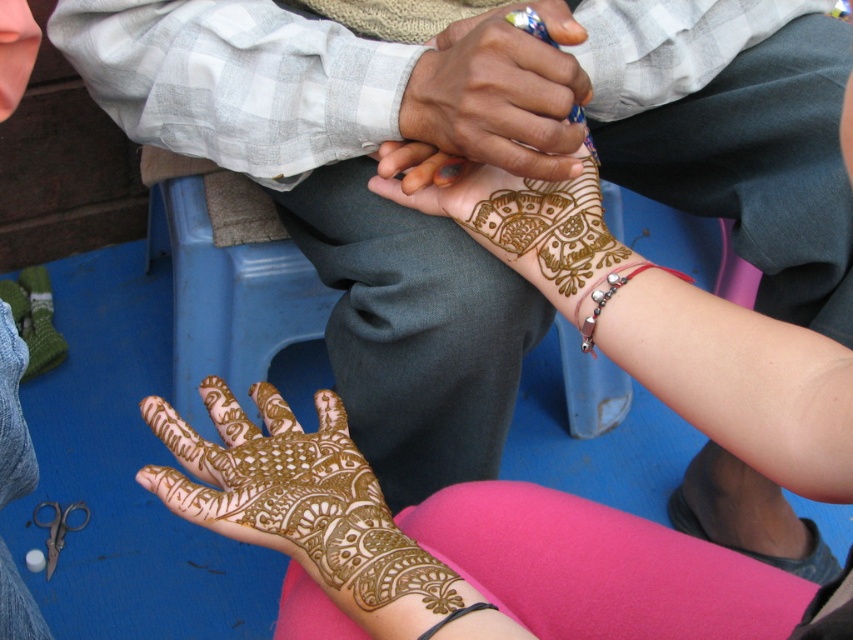
In the scene shown: Who is taller, brown henna tattoo at center or silver metallic bracelet at lower center?

Standing taller between the two is brown henna tattoo at center.

Can you confirm if brown henna tattoo at center is positioned to the left of silver metallic bracelet at lower center?

Yes, brown henna tattoo at center is to the left of silver metallic bracelet at lower center.

Where is `brown henna tattoo at center`? This screenshot has width=853, height=640. brown henna tattoo at center is located at coordinates (300, 502).

You are a GUI agent. You are given a task and a screenshot of the screen. Output one action in this format:
    pyautogui.click(x=<x>, y=<y>)
    Task: Click on the brown henna tattoo at center
    
    Given the screenshot: What is the action you would take?
    pyautogui.click(x=300, y=502)

The image size is (853, 640). What do you see at coordinates (491, 100) in the screenshot? I see `brown henna at center` at bounding box center [491, 100].

Is point (419, 74) less distant than point (611, 289)?

No, (419, 74) is further to viewer.

Locate an element on the screen. brown henna at center is located at coordinates (491, 100).

Is brown henna tattoo at center taller than brown henna at center?

Incorrect, brown henna tattoo at center's height is not larger of brown henna at center's.

Does brown henna tattoo at center lie in front of brown henna at center?

Yes, it is.

This screenshot has width=853, height=640. I want to click on brown henna tattoo at center, so click(300, 502).